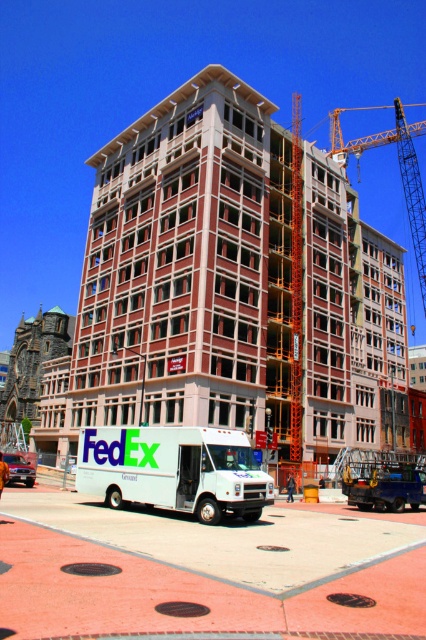
From the picture: Does white glossy fedex truck at center have a lesser height compared to orange metallic crane at upper right?

Yes.

The height and width of the screenshot is (640, 426). Describe the element at coordinates (173, 470) in the screenshot. I see `white glossy fedex truck at center` at that location.

Locate an element on the screen. The height and width of the screenshot is (640, 426). white glossy fedex truck at center is located at coordinates (173, 470).

Which of these two, white concrete construction site at center or white glossy fedex truck at center, stands shorter?

Standing shorter between the two is white glossy fedex truck at center.

You are a GUI agent. You are given a task and a screenshot of the screen. Output one action in this format:
    pyautogui.click(x=<x>, y=<y>)
    Task: Click on the white concrete construction site at center
    The height and width of the screenshot is (640, 426).
    Given the screenshot: What is the action you would take?
    pyautogui.click(x=207, y=572)

I want to click on white concrete construction site at center, so click(207, 572).

Does point (331, 621) come behind point (386, 492)?

No, (331, 621) is in front of (386, 492).

What do you see at coordinates (207, 572) in the screenshot?
I see `white concrete construction site at center` at bounding box center [207, 572].

Where is `white concrete construction site at center`? white concrete construction site at center is located at coordinates (207, 572).